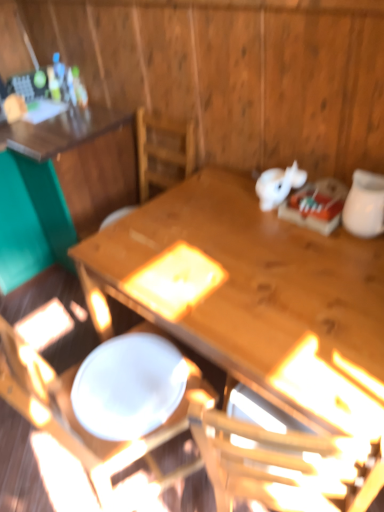
Question: From the image's perspective, would you say wooden table at center, the 1th table positioned from the right, is shown under white glossy jar at upper right?

Choices:
 (A) no
 (B) yes

Answer: (B)

Question: Is wooden table at center, which is the 2th table in left-to-right order, taller than white glossy jar at upper right?

Choices:
 (A) no
 (B) yes

Answer: (B)

Question: From a real-world perspective, is wooden table at center, which is the 2th table in left-to-right order, on white glossy jar at upper right?

Choices:
 (A) no
 (B) yes

Answer: (A)

Question: Is wooden table at center, which is the 2th table in left-to-right order, looking in the opposite direction of white glossy jar at upper right?

Choices:
 (A) no
 (B) yes

Answer: (A)

Question: Can we say wooden table at center, the 1th table positioned from the right, lies outside white glossy jar at upper right?

Choices:
 (A) yes
 (B) no

Answer: (A)

Question: Is white glossy jar at upper right bigger or smaller than wooden table at center, which is the 2th table in left-to-right order?

Choices:
 (A) small
 (B) big

Answer: (A)

Question: Is white glossy jar at upper right inside the boundaries of wooden table at center, which is the 2th table in left-to-right order, or outside?

Choices:
 (A) inside
 (B) outside

Answer: (B)

Question: Is white glossy jar at upper right wider or thinner than wooden table at center, which is the 2th table in left-to-right order?

Choices:
 (A) wide
 (B) thin

Answer: (B)

Question: Is white glossy jar at upper right taller or shorter than wooden table at center, which is the 2th table in left-to-right order?

Choices:
 (A) short
 (B) tall

Answer: (A)

Question: Looking at the image, does wooden chair at center seem bigger or smaller compared to white glossy plate at center?

Choices:
 (A) big
 (B) small

Answer: (A)

Question: Is point (31, 415) closer or farther from the camera than point (92, 351)?

Choices:
 (A) closer
 (B) farther

Answer: (A)

Question: Is wooden chair at center wider or thinner than white glossy plate at center?

Choices:
 (A) wide
 (B) thin

Answer: (A)

Question: From a real-world perspective, is wooden chair at center positioned above or below white glossy plate at center?

Choices:
 (A) below
 (B) above

Answer: (A)

Question: Is wooden chair at center inside or outside of wooden table at upper left, the 1th table when ordered from left to right?

Choices:
 (A) outside
 (B) inside

Answer: (A)

Question: Relative to wooden table at upper left, which appears as the 2th table when viewed from the right, is wooden chair at center in front or behind?

Choices:
 (A) behind
 (B) front

Answer: (B)